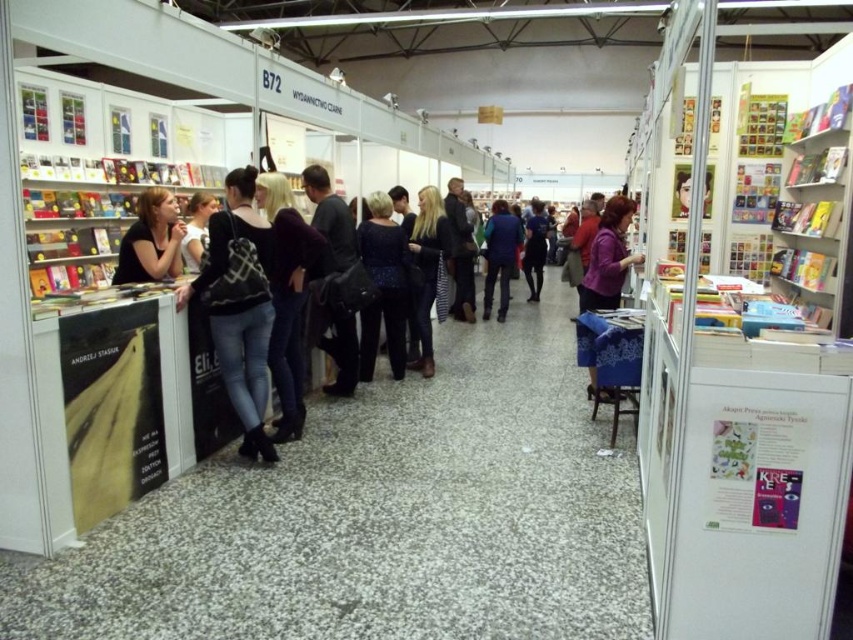
What is located at the coordinates point (239, 307) in the image?

The coordinates point (239, 307) is on the black textured backpack at left.

You are a salesperson at the book fair and need to hand a promotional flyer to both the person wearing the dark gray fabric jacket at center and the person wearing the matte black jacket at left. Which jacket is on top of the other when viewed from your position?

The dark gray fabric jacket at center is positioned over the matte black jacket at left, so the dark gray fabric jacket at center is on top when viewed from your position.

You are attending a book fair and notice two jackets in the crowd. The first is a dark gray fabric jacket at center, and the second is a matte black jacket at left. Which jacket is taller?

The dark gray fabric jacket at center is taller than the matte black jacket at left.